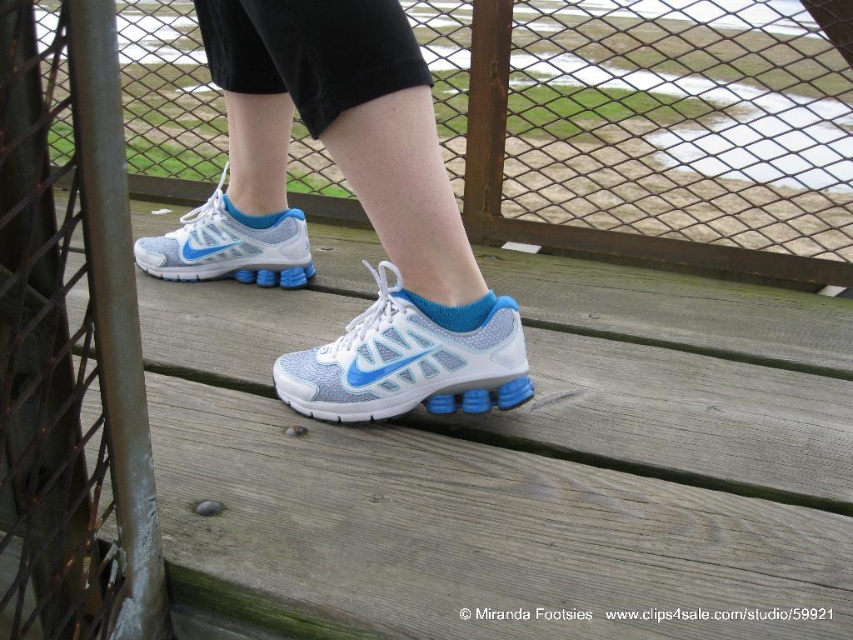
Question: Which of the following is the farthest from the observer?

Choices:
 (A) matte mesh shoe at center
 (B) light blue mesh shoe at center
 (C) light blue mesh sneakers at center

Answer: (A)

Question: Which object appears farthest from the camera in this image?

Choices:
 (A) green metal pole at left
 (B) metal mesh fence at upper left

Answer: (B)

Question: Which of the following is the closest to the observer?

Choices:
 (A) (289, 237)
 (B) (222, 220)
 (C) (335, 340)
 (D) (201, 93)

Answer: (C)

Question: Is green metal pole at left positioned before light blue mesh shoe at center?

Choices:
 (A) yes
 (B) no

Answer: (A)

Question: Is metal mesh fence at upper left behind light blue mesh sneakers at center?

Choices:
 (A) yes
 (B) no

Answer: (A)

Question: Observing the image, what is the correct spatial positioning of green metal pole at left in reference to light blue mesh sneakers at center?

Choices:
 (A) below
 (B) above

Answer: (A)